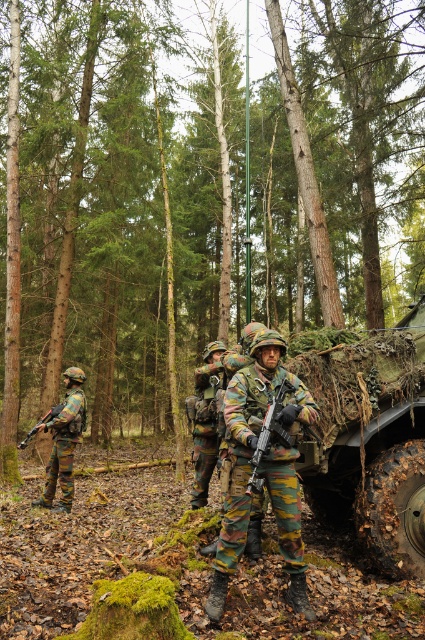
Between camouflage-patterned rifle at center and camouflage-patterned rifle at left, which one has more height?

camouflage-patterned rifle at left is taller.

Is point (269, 420) closer to camera compared to point (27, 438)?

Yes, point (269, 420) is in front of point (27, 438).

You are a GUI agent. You are given a task and a screenshot of the screen. Output one action in this format:
    pyautogui.click(x=<x>, y=<y>)
    Task: Click on the camouflage-patterned rifle at center
    Image resolution: width=425 pixels, height=640 pixels.
    Given the screenshot: What is the action you would take?
    pyautogui.click(x=268, y=435)

Who is shorter, camo fabric uniform at left or camouflage-patterned rifle at left?

camo fabric uniform at left is shorter.

Which is above, camo fabric uniform at left or camouflage-patterned rifle at left?

Positioned higher is camo fabric uniform at left.

Which is behind, point (54, 429) or point (28, 436)?

The point (54, 429) is more distant.

At what (x,y) coordinates should I click in order to perform the action: click on camo fabric uniform at left. Please return your answer as a coordinate pair (x, y). The image size is (425, 640). Looking at the image, I should click on (64, 440).

Between camo-patterned uniform at center and camo fabric uniform at left, which one appears on the left side from the viewer's perspective?

camo fabric uniform at left

Is camo-patterned uniform at center positioned before camo fabric uniform at left?

Yes, it is in front of camo fabric uniform at left.

Does point (288, 552) come behind point (82, 420)?

No, (288, 552) is closer to viewer.

Locate an element on the screen. camo-patterned uniform at center is located at coordinates (263, 465).